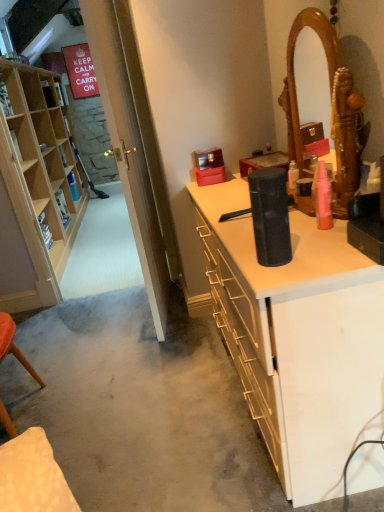
Question: From a real-world perspective, is black matte speaker at center below transparent glass door at left?

Choices:
 (A) yes
 (B) no

Answer: (A)

Question: Is transparent glass door at left completely or partially inside black matte speaker at center?

Choices:
 (A) no
 (B) yes

Answer: (A)

Question: From the image's perspective, is black matte speaker at center located beneath transparent glass door at left?

Choices:
 (A) yes
 (B) no

Answer: (A)

Question: Can you confirm if black matte speaker at center is wider than transparent glass door at left?

Choices:
 (A) yes
 (B) no

Answer: (A)

Question: Is black matte speaker at center at the right side of transparent glass door at left?

Choices:
 (A) yes
 (B) no

Answer: (A)

Question: Considering the relative sizes of black matte speaker at center and transparent glass door at left in the image provided, is black matte speaker at center taller than transparent glass door at left?

Choices:
 (A) yes
 (B) no

Answer: (B)

Question: Can you confirm if pink matte spray can at upper right is smaller than light wood cabinet at left?

Choices:
 (A) no
 (B) yes

Answer: (B)

Question: Is light wood cabinet at left at the back of pink matte spray can at upper right?

Choices:
 (A) no
 (B) yes

Answer: (A)

Question: Is pink matte spray can at upper right positioned beyond the bounds of light wood cabinet at left?

Choices:
 (A) yes
 (B) no

Answer: (A)

Question: Does pink matte spray can at upper right have a greater width compared to light wood cabinet at left?

Choices:
 (A) yes
 (B) no

Answer: (B)

Question: Is pink matte spray can at upper right oriented towards light wood cabinet at left?

Choices:
 (A) no
 (B) yes

Answer: (A)

Question: Can you confirm if pink matte spray can at upper right is taller than light wood cabinet at left?

Choices:
 (A) no
 (B) yes

Answer: (A)

Question: From the image's perspective, would you say black matte speaker at center is shown under pink matte spray can at upper right?

Choices:
 (A) no
 (B) yes

Answer: (B)